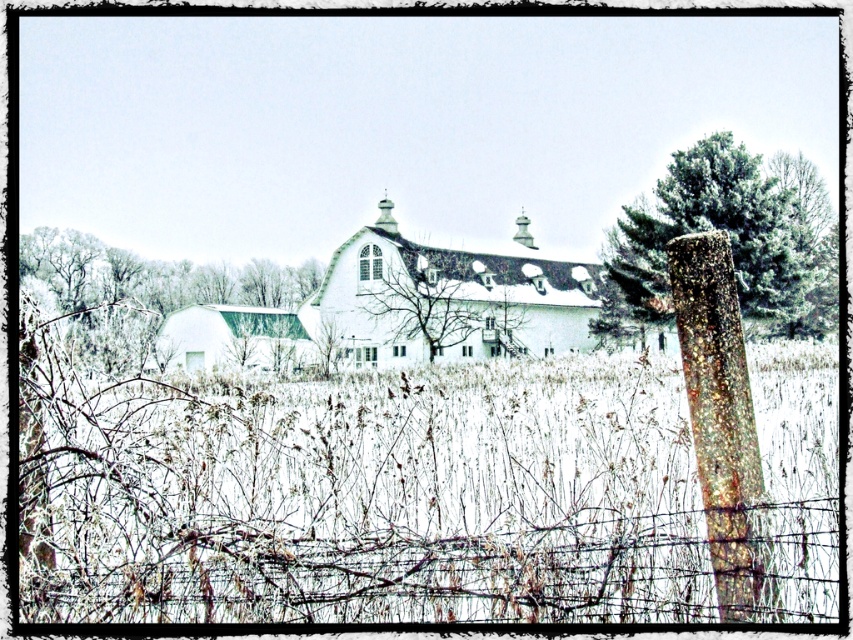
You are standing at the wooden post on the right side of the image. Which direction should you look to see the barbed wire fence at lower center?

The barbed wire fence at lower center is located at point (456, 572), so you should look to the lower center direction from the wooden post on the right side.

You are standing at the wooden post on the right side of the barbed wire fence. You want to walk directly towards the green textured pine at right. In which direction should you head relative to the fence?

Since the green textured pine at right is located at point (730, 237), you should head towards the right side relative to the fence to reach it.